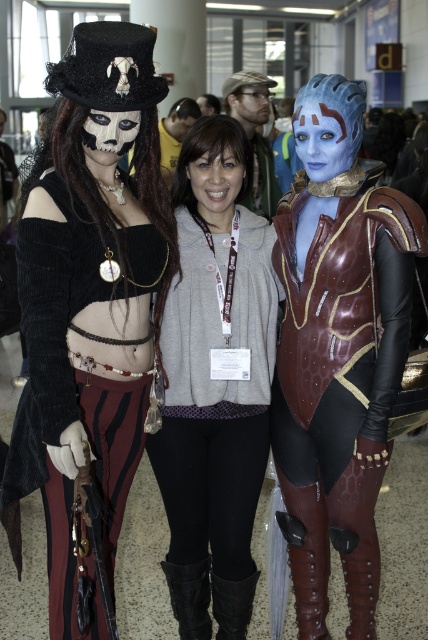
Question: Can you confirm if matte black hat at left is bigger than gray fleece hoodie at center?

Choices:
 (A) no
 (B) yes

Answer: (B)

Question: Which point appears farthest from the camera in this image?

Choices:
 (A) (95, 586)
 (B) (225, 336)

Answer: (B)

Question: Is matte black hat at left behind gray fleece hoodie at center?

Choices:
 (A) yes
 (B) no

Answer: (B)

Question: Where is blue metallic armor at right located in relation to gray fleece hoodie at center in the image?

Choices:
 (A) above
 (B) below

Answer: (A)

Question: Estimate the real-world distances between objects in this image. Which object is closer to the matte black hat at left?

Choices:
 (A) blue metallic armor at right
 (B) gray fleece hoodie at center

Answer: (B)

Question: Among these objects, which one is farthest from the camera?

Choices:
 (A) matte black hat at left
 (B) blue metallic armor at right
 (C) gray fleece hoodie at center

Answer: (C)